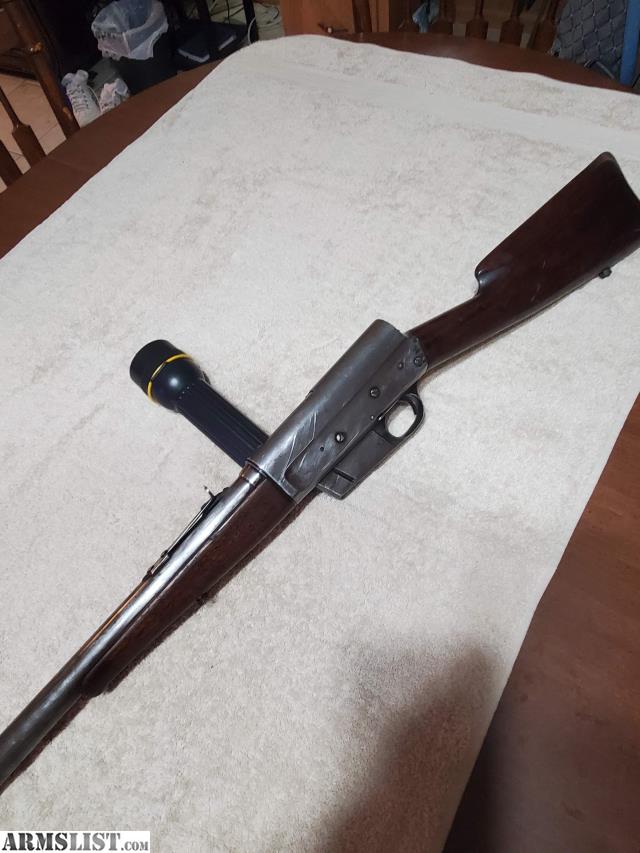
Where is `trash bag around trash can`? This screenshot has width=640, height=853. trash bag around trash can is located at coordinates (125, 36).